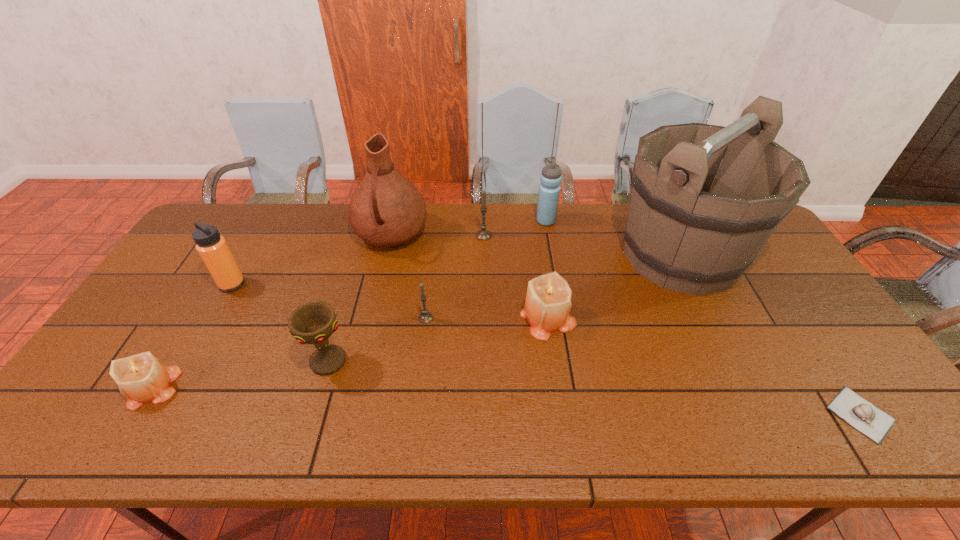
The image size is (960, 540). I want to click on bucket, so click(679, 234).

What are the coordinates of `the second tallest object` in the screenshot? It's located at (386, 209).

Find the location of a particular element. The width and height of the screenshot is (960, 540). water bottle is located at coordinates (549, 190).

Where is `thermos bottle`? This screenshot has width=960, height=540. thermos bottle is located at coordinates (211, 246).

Where is `the right gray candle`? This screenshot has width=960, height=540. the right gray candle is located at coordinates (483, 234).

This screenshot has width=960, height=540. What are the coordinates of `the third candle from left to right` in the screenshot? It's located at (483, 234).

The width and height of the screenshot is (960, 540). I want to click on chalice, so click(x=312, y=323).

Where is `the bigger beige candle`? the bigger beige candle is located at coordinates (548, 301).

Locate an element on the screen. the rightmost candle is located at coordinates (548, 301).

You are a GUI agent. You are given a task and a screenshot of the screen. Output one action in this format:
    pyautogui.click(x=<x>, y=<y>)
    Task: Click on the left gray candle
    This screenshot has height=540, width=960.
    Given the screenshot: What is the action you would take?
    pyautogui.click(x=425, y=317)